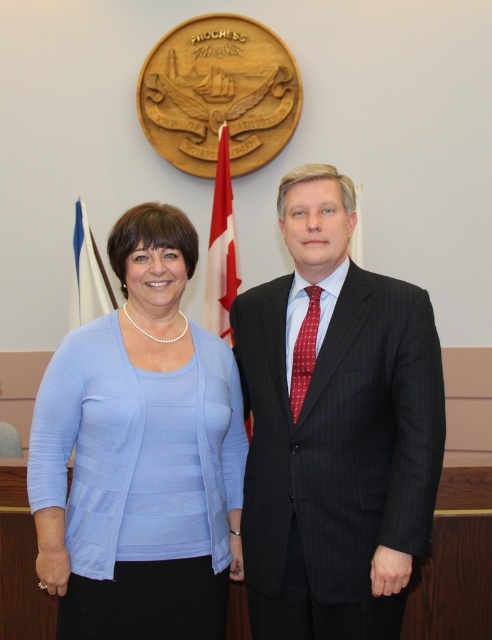
In the scene shown: Does dark pinstripe suit at center appear on the left side of blue fabric flag at left?

Incorrect, dark pinstripe suit at center is not on the left side of blue fabric flag at left.

Can you confirm if dark pinstripe suit at center is shorter than blue fabric flag at left?

In fact, dark pinstripe suit at center may be taller than blue fabric flag at left.

Does point (305, 282) come farther from viewer compared to point (99, 278)?

No, it is in front of (99, 278).

The image size is (492, 640). I want to click on dark pinstripe suit at center, so click(x=335, y=428).

In the scene shown: Is light blue fabric shirt at center positioned in front of blue fabric flag at left?

Yes, light blue fabric shirt at center is closer to the viewer.

Based on the photo, which of these two, light blue fabric shirt at center or blue fabric flag at left, stands taller?

light blue fabric shirt at center is taller.

Describe the element at coordinates (141, 454) in the screenshot. Image resolution: width=492 pixels, height=640 pixels. I see `light blue fabric shirt at center` at that location.

Locate an element on the screen. The image size is (492, 640). light blue fabric shirt at center is located at coordinates (141, 454).

Between dark pinstripe suit at center and light blue fabric shirt at center, which one is positioned higher?

Positioned higher is dark pinstripe suit at center.

Can you confirm if dark pinstripe suit at center is smaller than light blue fabric shirt at center?

No, dark pinstripe suit at center is not smaller than light blue fabric shirt at center.

Which is in front, point (343, 365) or point (207, 609)?

Positioned in front is point (343, 365).

At what (x,y) coordinates should I click in order to perform the action: click on dark pinstripe suit at center. Please return your answer as a coordinate pair (x, y). This screenshot has height=640, width=492. Looking at the image, I should click on (335, 428).